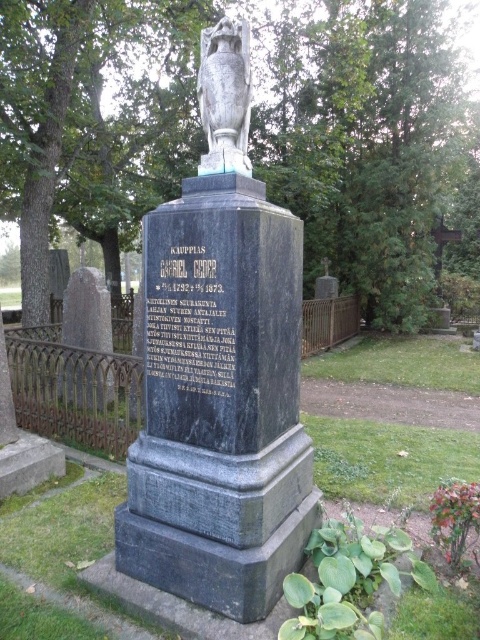
You are a photographer standing at a certain distance from the polished gray stone monument at center. You want to capture a photo where the monument fills the frame without cropping any part of it. If your camera has a focal length of 50mm, what is the minimum distance you should maintain to ensure the monument fits entirely within the frame?

The distance between the polished gray stone monument at center and the camera is 8.23 feet. To ensure the monument fits entirely within the frame at a 50mm focal length, you should maintain at least 8.23 feet of distance.

You are a visitor at the cemetery and want to take a photo of both the polished gray stone monument at center and the gray stone urn at center. Can you see both objects clearly in the same frame?

The polished gray stone monument at center is in front of the gray stone urn at center, so the monument may block part of the urn in the photo, making it difficult to see both clearly at the same time.

You are standing at the entrance of the cemetery and want to locate the polished gray stone monument at center. According to the image, what are the coordinates of the monument?

The coordinates of the polished gray stone monument at center are at point (220, 372).